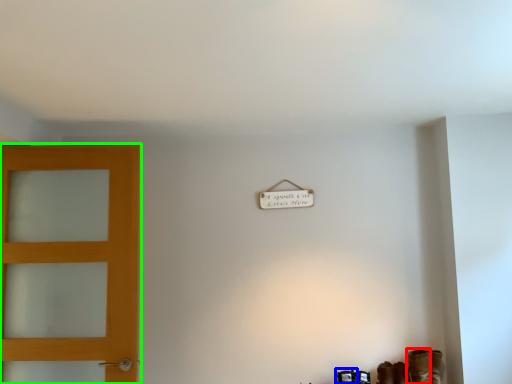
Question: Considering the real-world distances, which object is closest to boot (highlighted by a red box)? shoe (highlighted by a blue box) or door (highlighted by a green box).

Choices:
 (A) shoe
 (B) door

Answer: (A)